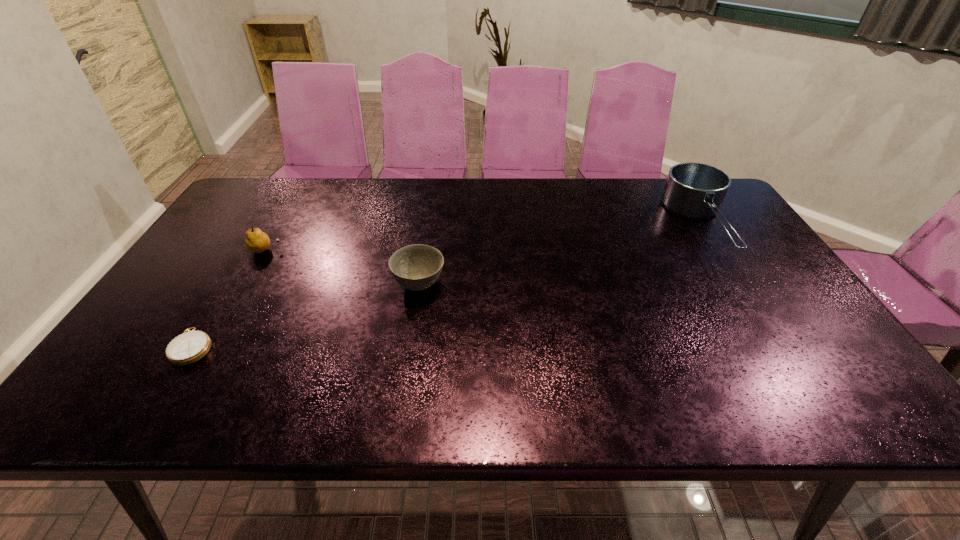
You are a GUI agent. You are given a task and a screenshot of the screen. Output one action in this format:
    pyautogui.click(x=<x>, y=<y>)
    Task: Click on the empty location between the shortest object and the tallest object
    This screenshot has height=540, width=960.
    Given the screenshot: What is the action you would take?
    pyautogui.click(x=448, y=286)

I want to click on free spot between the pear and the bowl, so click(x=343, y=267).

Identify the location of free spot between the rightmost object and the pear. Image resolution: width=960 pixels, height=540 pixels. [485, 238].

Locate an element on the screen. vacant space in between the compass and the pear is located at coordinates (229, 298).

Where is `vacant area between the pear and the second object from right to left`? This screenshot has width=960, height=540. vacant area between the pear and the second object from right to left is located at coordinates (343, 267).

Where is `free space between the bowl and the tallest object`? free space between the bowl and the tallest object is located at coordinates (562, 255).

Find the location of `free spot between the third object from left to right and the nearest object`. free spot between the third object from left to right and the nearest object is located at coordinates (306, 315).

At what (x,y) coordinates should I click in order to perform the action: click on free point between the pear and the nearest object. Please return your answer as a coordinate pair (x, y). Looking at the image, I should click on (229, 298).

Locate an element on the screen. This screenshot has height=540, width=960. free space between the saucepan and the nearest object is located at coordinates (448, 286).

Where is `empty space that is in between the nearest object and the pear`? This screenshot has width=960, height=540. empty space that is in between the nearest object and the pear is located at coordinates (229, 298).